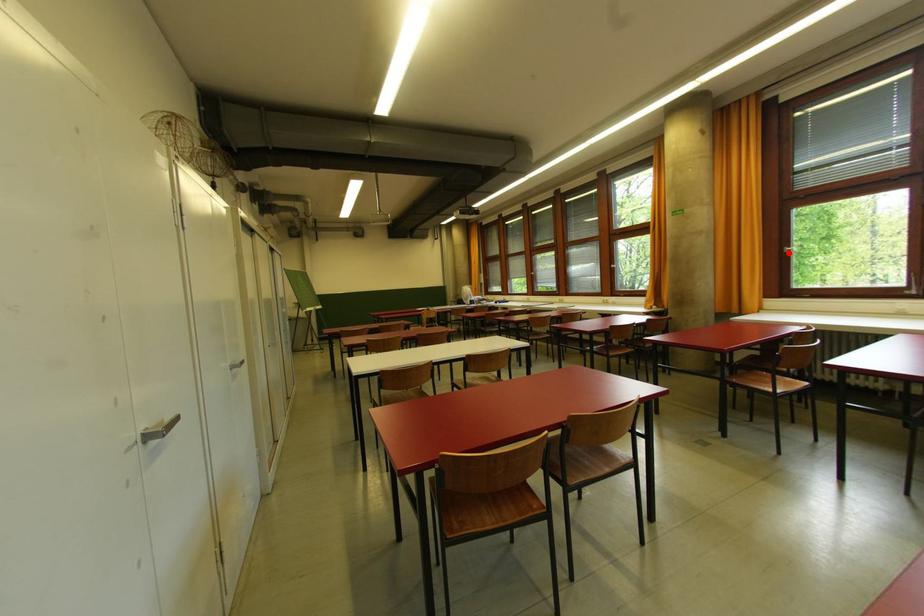
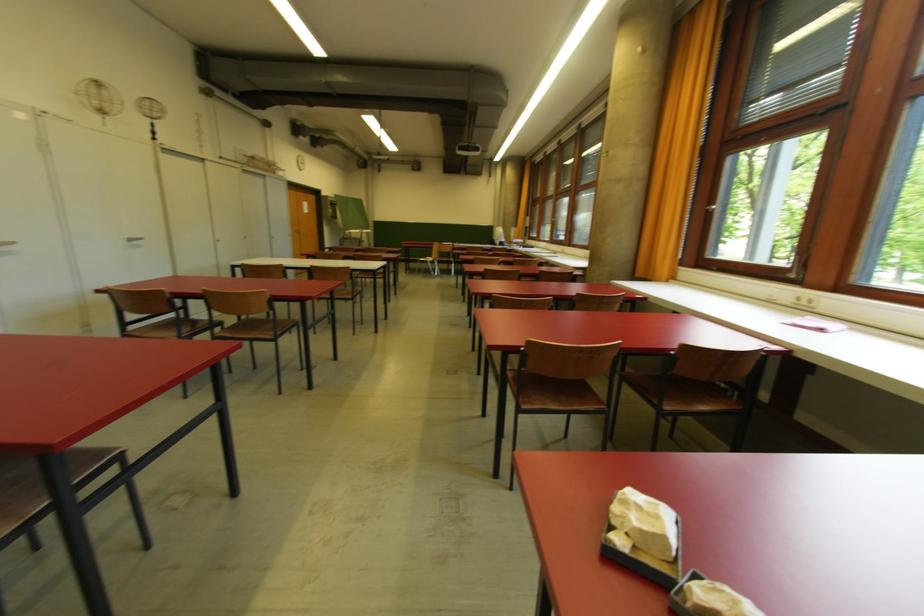
The point at the highlighted location is marked in the first image. Where is the corresponding point in the second image?

(713, 213)